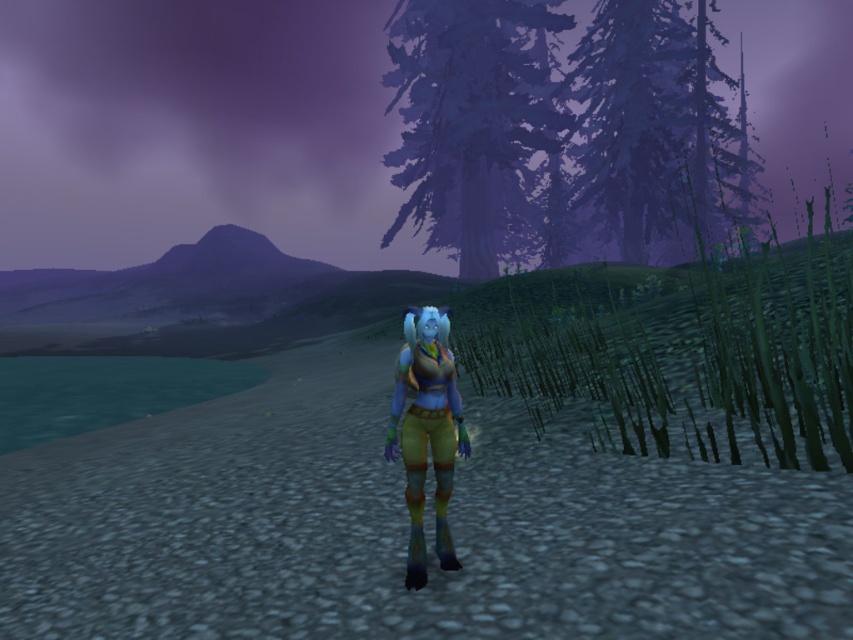
Measure the distance between purple matte tree at upper center and camera.

purple matte tree at upper center is 73.50 feet away from camera.

Which is below, purple matte tree at upper center or dark blue textured pine tree at upper right?

purple matte tree at upper center

Is point (549, 84) less distant than point (605, 67)?

No, (549, 84) is behind (605, 67).

Find the location of a particular element. purple matte tree at upper center is located at coordinates (471, 122).